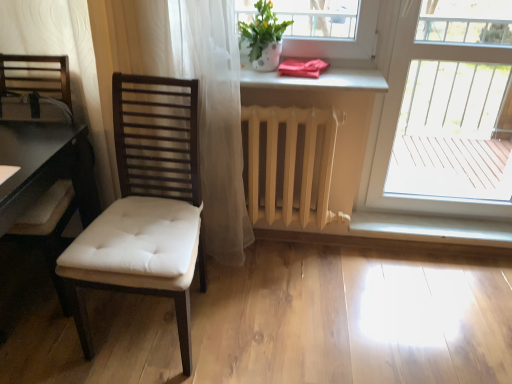
You are a GUI agent. You are given a task and a screenshot of the screen. Output one action in this format:
    pyautogui.click(x=<x>, y=<y>)
    Task: Click on the free region under white matte radiator at center (from a real-world perspective)
    The image size is (512, 384).
    Given the screenshot: What is the action you would take?
    pyautogui.click(x=297, y=252)